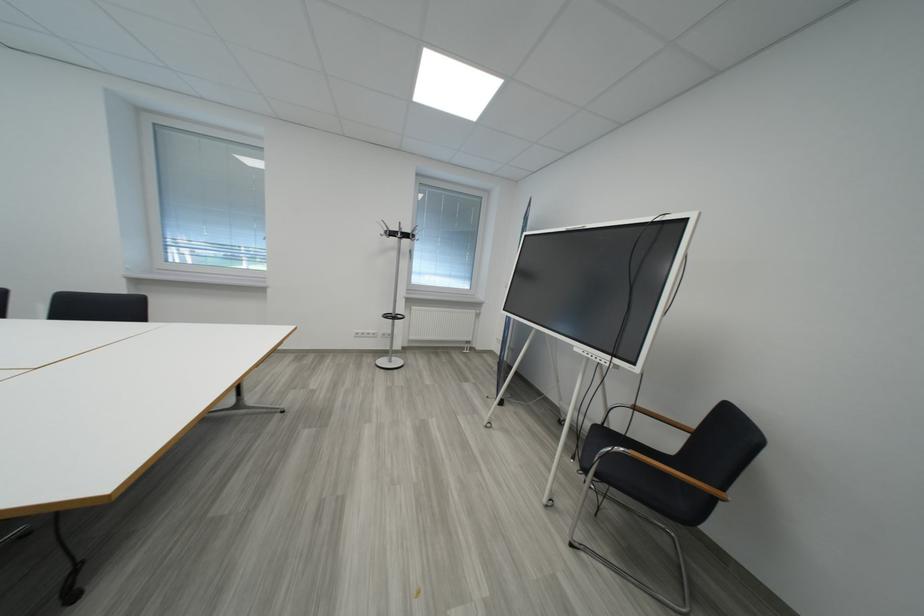
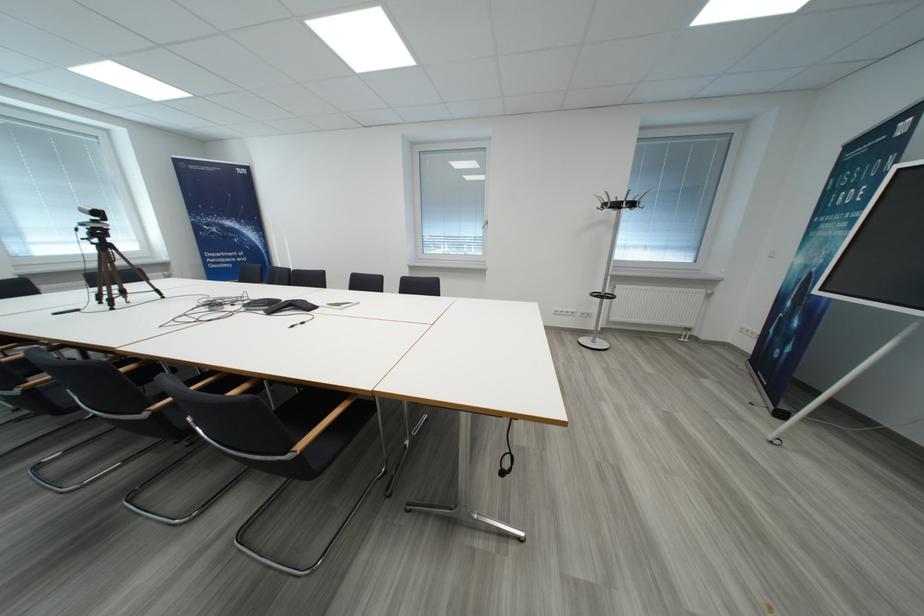
Question: The camera is either moving clockwise (left) or counter-clockwise (right) around the object. The first image is from the beginning of the video and the second image is from the end. Is the camera moving left or right when shooting the video?

Choices:
 (A) Left
 (B) Right

Answer: (B)